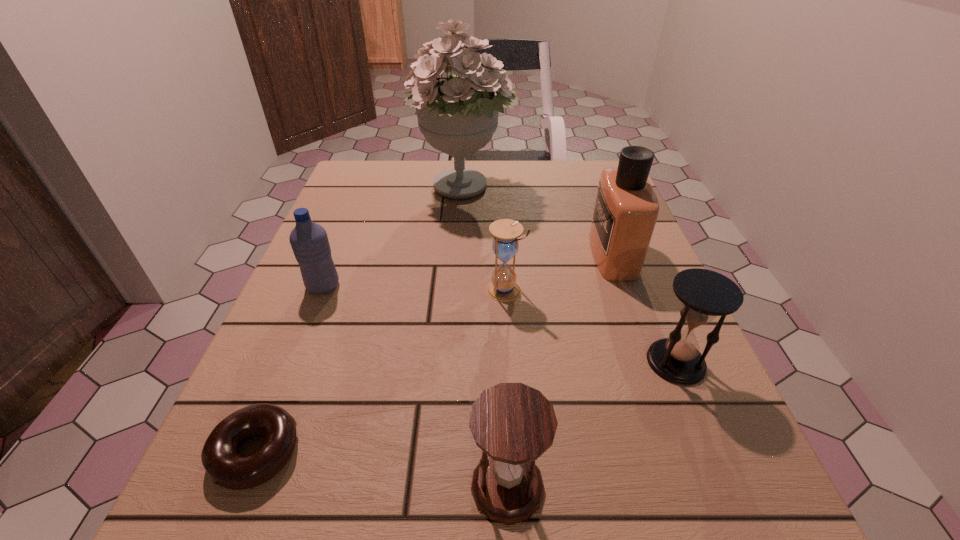
Identify the location of the tallest object. This screenshot has width=960, height=540. coord(458,116).

Locate an element on the screen. bouquet is located at coordinates (458, 116).

Find the location of a particular element. The width and height of the screenshot is (960, 540). perfume is located at coordinates (626, 209).

Locate an element on the screen. The height and width of the screenshot is (540, 960). water bottle is located at coordinates (309, 241).

Locate an element on the screen. Image resolution: width=960 pixels, height=540 pixels. the farthest hourglass is located at coordinates (503, 287).

The width and height of the screenshot is (960, 540). I want to click on the rightmost hourglass, so click(x=705, y=294).

Find the location of `the second farthest hourglass`. the second farthest hourglass is located at coordinates (705, 294).

Locate an element on the screen. This screenshot has width=960, height=540. the nearest hourglass is located at coordinates (513, 424).

This screenshot has width=960, height=540. What are the coordinates of `the shortest object` in the screenshot? It's located at [226, 468].

Identify the location of vacant space situated on the right of the tallest object. This screenshot has width=960, height=540. (545, 189).